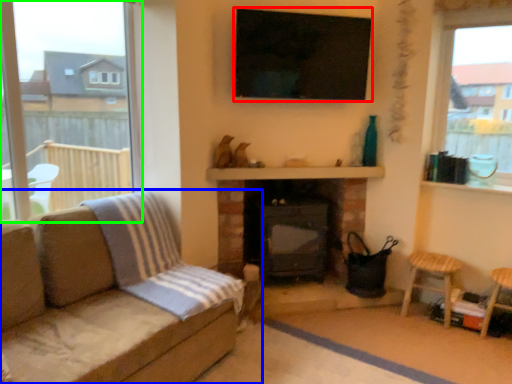
Question: Estimate the real-world distances between objects in this image. Which object is farther from window screen (highlighted by a red box), studio couch (highlighted by a blue box) or window (highlighted by a green box)?

Choices:
 (A) studio couch
 (B) window

Answer: (B)